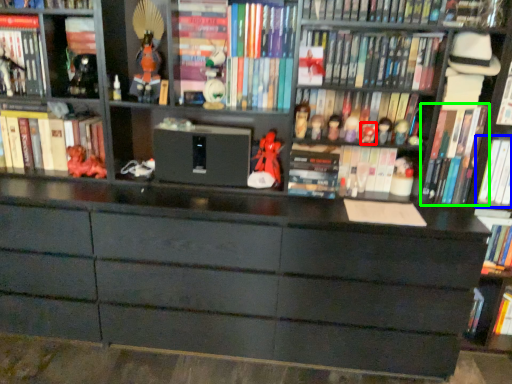
Question: Which object is positioned closest to toy (highlighted by a red box)? Select from book (highlighted by a blue box) and book (highlighted by a green box).

Choices:
 (A) book
 (B) book

Answer: (B)